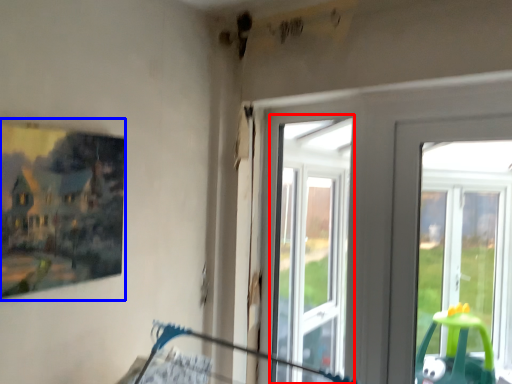
Question: Which point is further to the camera, bay window (highlighted by a red box) or picture frame (highlighted by a blue box)?

Choices:
 (A) bay window
 (B) picture frame

Answer: (A)